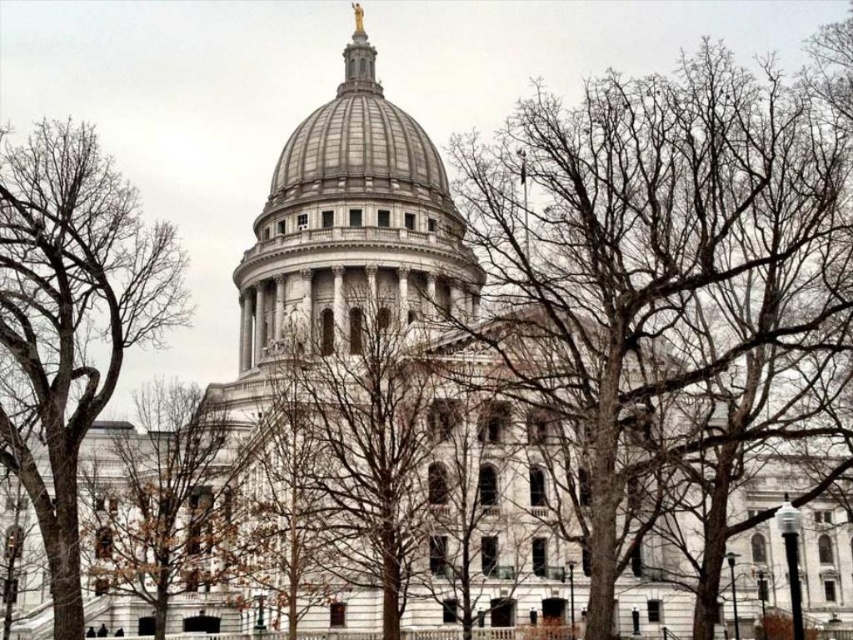
Question: Which of the following is the closest to the observer?

Choices:
 (A) (390, 387)
 (B) (717, 248)
 (C) (96, 557)
 (D) (61, 620)

Answer: (D)

Question: Is bare branches at center to the right of bare branches at left from the viewer's perspective?

Choices:
 (A) yes
 (B) no

Answer: (A)

Question: Among these objects, which one is farthest from the camera?

Choices:
 (A) bare branches at center
 (B) bare branches at left
 (C) brown leafless tree at lower left
 (D) bare wood tree at center

Answer: (C)

Question: Estimate the real-world distances between objects in this image. Which object is farther from the bare wood tree at center?

Choices:
 (A) bare branches at center
 (B) brown leafless tree at lower left

Answer: (A)

Question: Does bare branches at left come in front of brown leafless tree at lower left?

Choices:
 (A) no
 (B) yes

Answer: (B)

Question: Is bare branches at center further to camera compared to brown leafless tree at lower left?

Choices:
 (A) no
 (B) yes

Answer: (A)